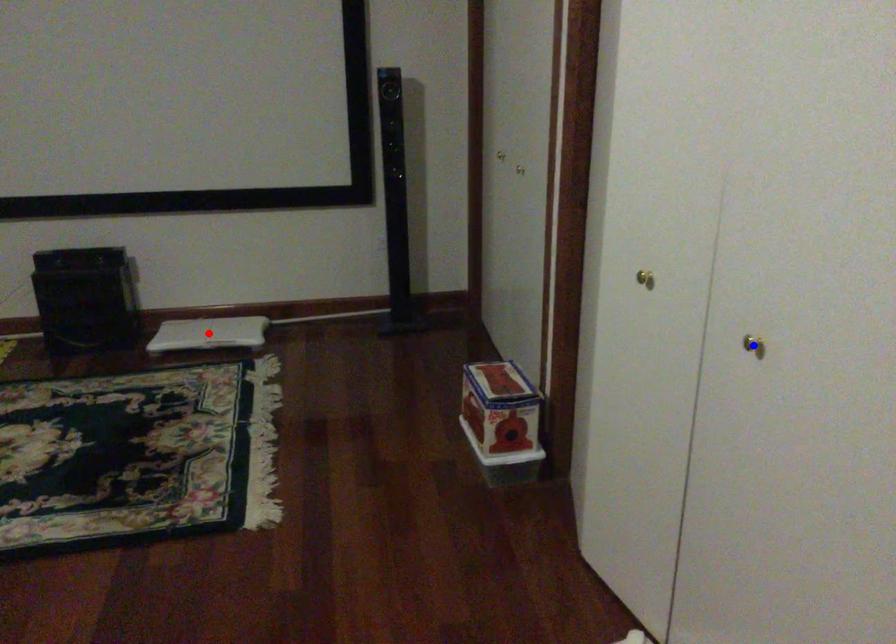
Question: Two points are marked on the image. Which point is closer to the camera?

Choices:
 (A) Blue point is closer.
 (B) Red point is closer.

Answer: (A)